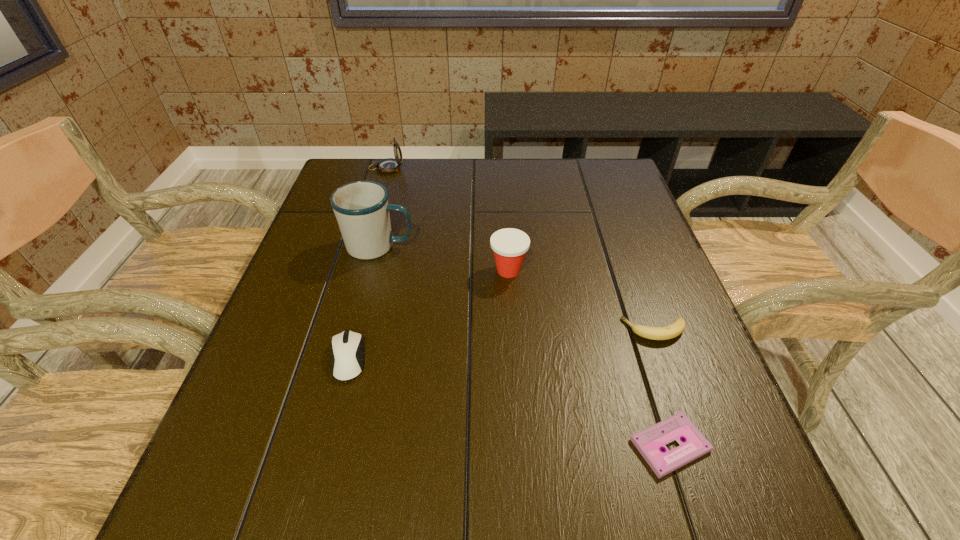
Image resolution: width=960 pixels, height=540 pixels. In order to click on vacant space located 0.200m on the back of the third shortest object in this screenshot , I will do pyautogui.click(x=372, y=268).

At what (x,y) coordinates should I click in order to perform the action: click on free space located 0.310m at the stem of the second shortest object. Please return your answer as a coordinate pair (x, y). Looking at the image, I should click on (470, 330).

I want to click on vacant space located 0.120m at the stem of the second shortest object, so click(564, 330).

You are a GUI agent. You are given a task and a screenshot of the screen. Output one action in this format:
    pyautogui.click(x=<x>, y=<y>)
    Task: Click on the free region located at the stem of the second shortest object
    The height and width of the screenshot is (540, 960).
    Given the screenshot: What is the action you would take?
    pyautogui.click(x=540, y=330)

Where is `vacant area located on the back of the nearest object`? This screenshot has height=540, width=960. vacant area located on the back of the nearest object is located at coordinates (631, 321).

In order to click on object positioned at the far edge in this screenshot , I will do pyautogui.click(x=390, y=165).

The width and height of the screenshot is (960, 540). In order to click on object present at the near edge in this screenshot , I will do `click(649, 442)`.

The height and width of the screenshot is (540, 960). Identify the location of mug that is at the left edge. (361, 208).

In order to click on compass that is at the left edge in this screenshot , I will do `click(390, 165)`.

Identify the location of mouse that is positioned at the left edge. (347, 348).